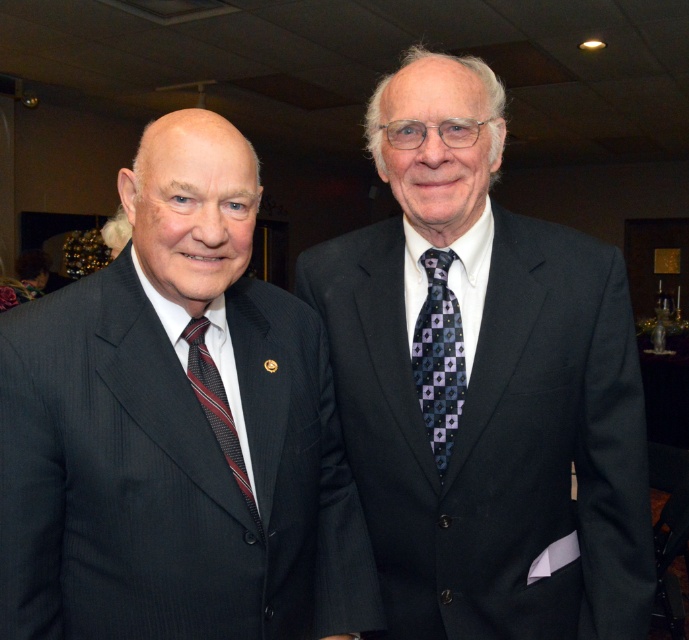
You are a photographer taking a picture of the two men in the scene. You want to focus on the point closer to you. Which point should you choose between point (382, 401) and point (192, 340)?

Point (382, 401) is further to the viewer than point (192, 340), so you should choose point (382, 401) to focus on the point closer to you.

You are organizing a charity event and need to ensure that all attendees have ties that are not too large for their collars. You notice two men in the image wearing ties. Which tie, the dark blue textured tie at center or the striped silk tie at left, is more likely to require a larger collar size due to its size?

The dark blue textured tie at center is bigger than the striped silk tie at left, so it is more likely to require a larger collar size due to its size.